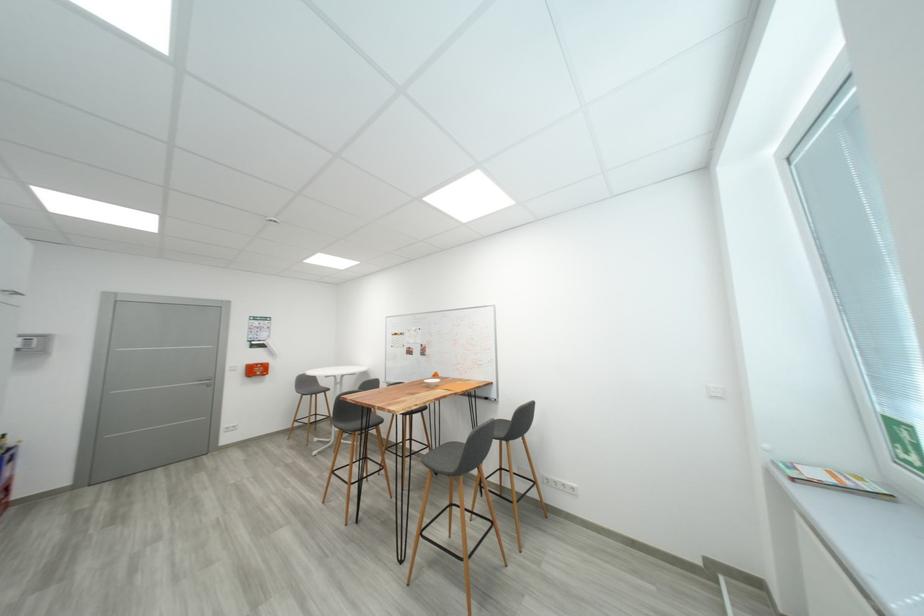
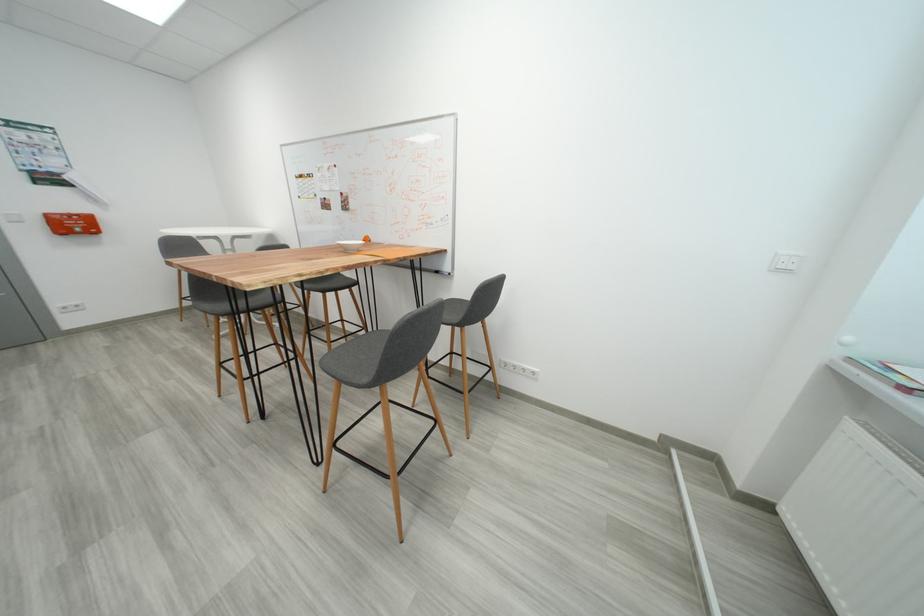
Find the pixel in the second image that matches (553,477) in the first image.

(511, 361)